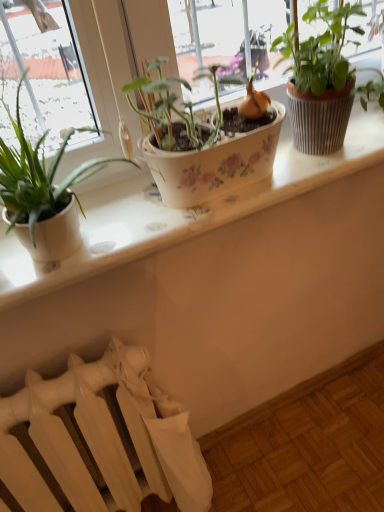
Identify the location of free point below textured brown pot at upper right, the 1th houseplant viewed from the right (from a real-world perspective). The width and height of the screenshot is (384, 512). (336, 155).